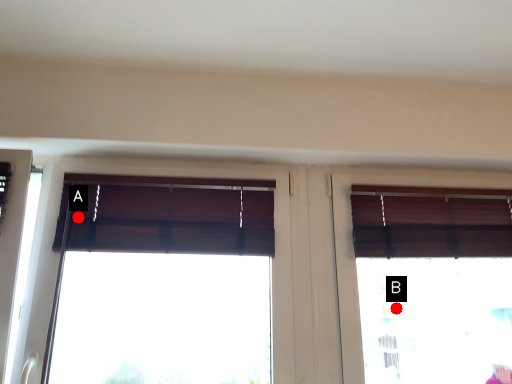
Question: Two points are circled on the image, labeled by A and B beside each circle. Which point appears closest to the camera in this image?

Choices:
 (A) A is closer
 (B) B is closer

Answer: (A)